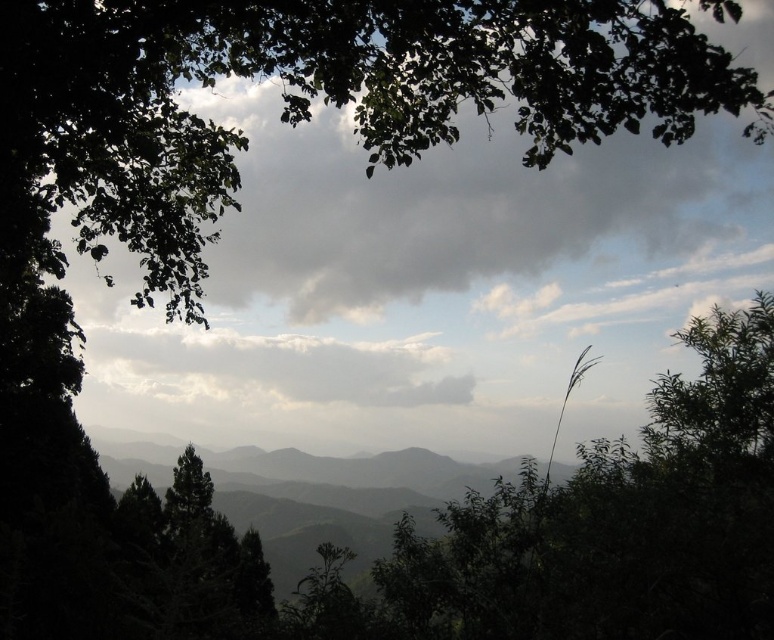
Who is more forward, (341, 172) or (128, 364)?

Point (341, 172)

This screenshot has width=774, height=640. What do you see at coordinates (427, 209) in the screenshot? I see `gray cloudy sky at upper center` at bounding box center [427, 209].

Where is `gray cloudy sky at upper center`? The image size is (774, 640). gray cloudy sky at upper center is located at coordinates (427, 209).